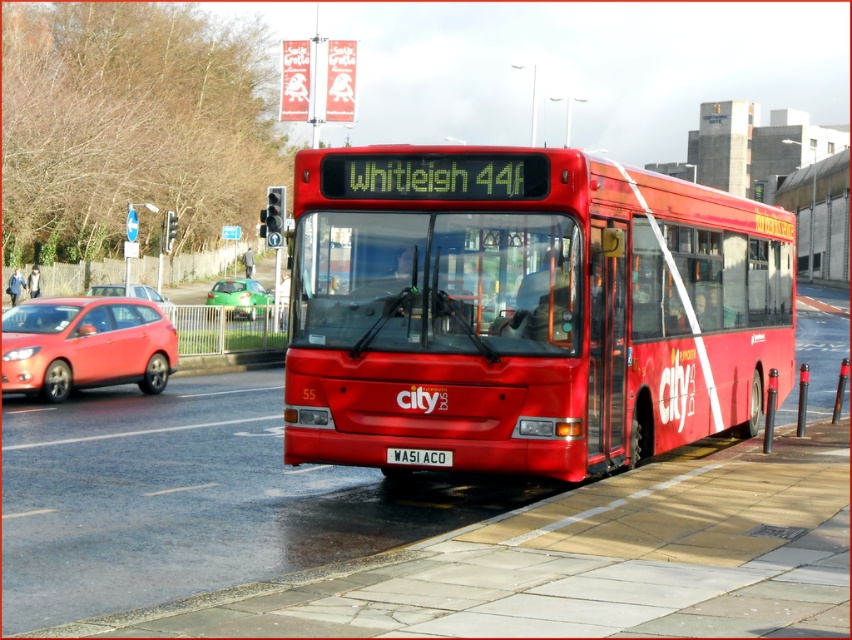
You are a delivery person needing to park your 1.8 meter wide van between the matte red hatchback at left and the green glossy car at left. Can your van fit in the space between them?

The matte red hatchback at left is thinner than the green glossy car at left, but the exact width between them isn not specified. Without knowing the distance between the two cars, it is impossible to determine if the van will fit.

You are standing at the bus stop where the red Plymouth Citybus is parked. You need to cross the street to reach the other side. There is a matte red hatchback at left. Based on its position, which direction should you look before crossing?

The matte red hatchback at left is located at point (85, 346), which is on the left side of the frame. Before crossing the street, you should look to the left to ensure no vehicles like the matte red hatchback at left are approaching from that direction.